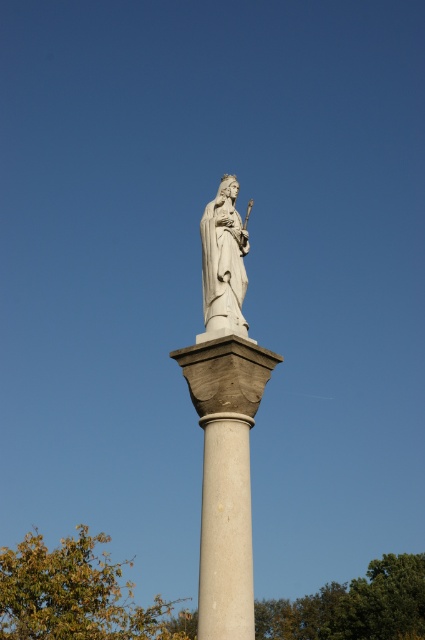
Question: Is white stone column at center positioned before white marble column at center?

Choices:
 (A) yes
 (B) no

Answer: (B)

Question: Observing the image, what is the correct spatial positioning of white stone column at center in reference to white marble statue at center?

Choices:
 (A) left
 (B) right

Answer: (B)

Question: Which is nearer to the white marble statue at center?

Choices:
 (A) white stone column at center
 (B) white marble column at center

Answer: (A)

Question: Is white stone column at center in front of white marble column at center?

Choices:
 (A) yes
 (B) no

Answer: (B)

Question: Which object appears closest to the camera in this image?

Choices:
 (A) white marble statue at center
 (B) white stone column at center
 (C) white marble column at center

Answer: (C)

Question: Which of these objects is positioned farthest from the white marble column at center?

Choices:
 (A) white marble statue at center
 (B) white stone column at center

Answer: (A)